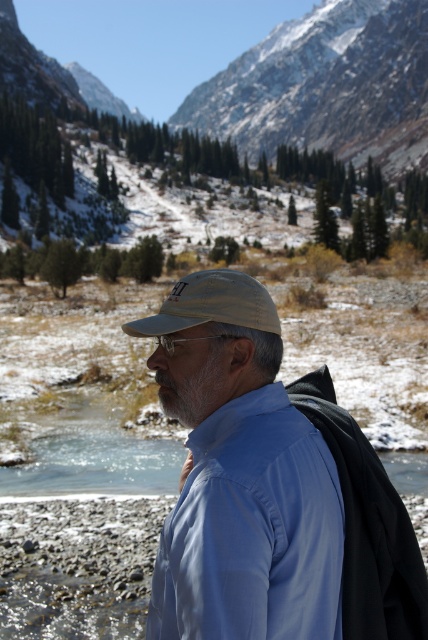
Measure the distance between blue smooth shirt at center and snowy rocky mountain at upper center.

blue smooth shirt at center is 479.39 meters from snowy rocky mountain at upper center.

Looking at this image, who is positioned more to the left, blue smooth shirt at center or snowy rocky mountain at upper center?

Positioned to the left is blue smooth shirt at center.

Between point (208, 433) and point (231, 129), which one is positioned behind?

Positioned behind is point (231, 129).

Locate an element on the screen. The width and height of the screenshot is (428, 640). blue smooth shirt at center is located at coordinates (252, 531).

Which is more to the right, snowy granite mountain at upper center or tan fabric cap at center?

Positioned to the right is snowy granite mountain at upper center.

The image size is (428, 640). I want to click on snowy granite mountain at upper center, so click(326, 84).

Can you confirm if snowy granite mountain at upper center is taller than snowy rocky mountain at upper center?

In fact, snowy granite mountain at upper center may be shorter than snowy rocky mountain at upper center.

Is point (421, 152) farther from camera compared to point (270, 150)?

No, (421, 152) is closer to viewer.

Who is more distant from viewer, [6,28] or [404,112]?

The point [404,112] is more distant.

This screenshot has height=640, width=428. I want to click on snowy granite mountain at upper center, so click(326, 84).